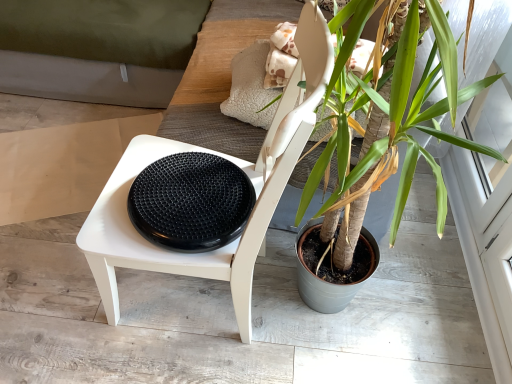
Question: Is point (130, 172) positioned closer to the camera than point (385, 163)?

Choices:
 (A) farther
 (B) closer

Answer: (A)

Question: Is white matte chair at center situated inside green leafy plant at center or outside?

Choices:
 (A) inside
 (B) outside

Answer: (B)

Question: Considering the real-world distances, which object is closest to the white matte chair at center?

Choices:
 (A) black rubber footrest at center
 (B) green leafy plant at center

Answer: (A)

Question: Based on their relative distances, which object is farther from the white matte chair at center?

Choices:
 (A) black rubber footrest at center
 (B) green leafy plant at center

Answer: (B)